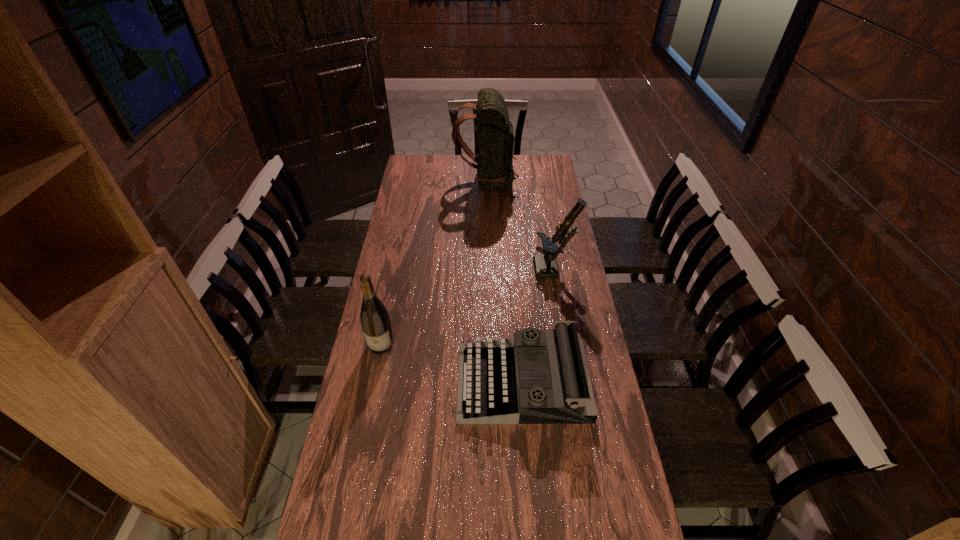
At what (x,y) coordinates should I click in order to perform the action: click on free space located at the eyepiece of the third nearest object. Please return your answer as a coordinate pair (x, y). This screenshot has width=960, height=540. Looking at the image, I should click on [x=436, y=270].

Locate an element on the screen. blank space located on the label of the leftmost object is located at coordinates (356, 467).

The width and height of the screenshot is (960, 540). In order to click on vacant space situated on the typing side of the typewriter in this screenshot , I will do `click(407, 383)`.

This screenshot has height=540, width=960. In order to click on vacant space located 0.120m on the typing side of the typewriter in this screenshot , I will do `click(420, 383)`.

Find the location of a particular element. The width and height of the screenshot is (960, 540). vacant space situated on the typing side of the typewriter is located at coordinates (423, 383).

Identify the location of object that is at the far edge. This screenshot has width=960, height=540. (495, 172).

Where is `object located in the left edge section of the desktop`? The height and width of the screenshot is (540, 960). object located in the left edge section of the desktop is located at coordinates (375, 321).

You are a GUI agent. You are given a task and a screenshot of the screen. Output one action in this format:
    pyautogui.click(x=<x>, y=<y>)
    Task: Click on the microscope positioned at the right edge
    The width and height of the screenshot is (960, 540).
    Given the screenshot: What is the action you would take?
    pyautogui.click(x=545, y=264)

The height and width of the screenshot is (540, 960). I want to click on typewriter present at the right edge, so click(538, 376).

This screenshot has width=960, height=540. What are the coordinates of `vacant point at the far edge` in the screenshot? It's located at point(443,177).